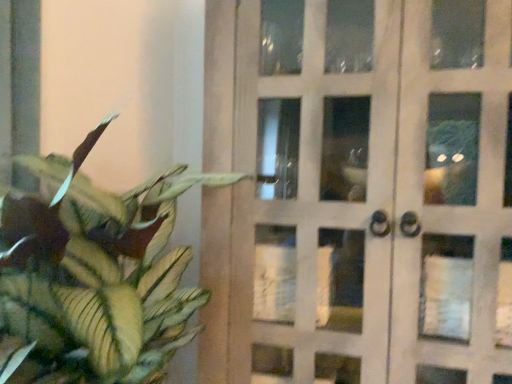
Question: Considering the positions of point (507, 31) and point (112, 337), is point (507, 31) closer or farther from the camera than point (112, 337)?

Choices:
 (A) closer
 (B) farther

Answer: (B)

Question: In terms of width, does white glass door at center look wider or thinner when compared to green matte leafy plant at left?

Choices:
 (A) thin
 (B) wide

Answer: (A)

Question: Considering their positions, is white glass door at center located in front of or behind green matte leafy plant at left?

Choices:
 (A) front
 (B) behind

Answer: (B)

Question: Looking at their shapes, would you say green matte leafy plant at left is wider or thinner than white glass door at center?

Choices:
 (A) wide
 (B) thin

Answer: (A)

Question: From the image's perspective, relative to white glass door at center, is green matte leafy plant at left above or below?

Choices:
 (A) above
 (B) below

Answer: (B)

Question: From a real-world perspective, is green matte leafy plant at left positioned above or below white glass door at center?

Choices:
 (A) below
 (B) above

Answer: (A)

Question: From their relative heights in the image, would you say green matte leafy plant at left is taller or shorter than white glass door at center?

Choices:
 (A) short
 (B) tall

Answer: (A)